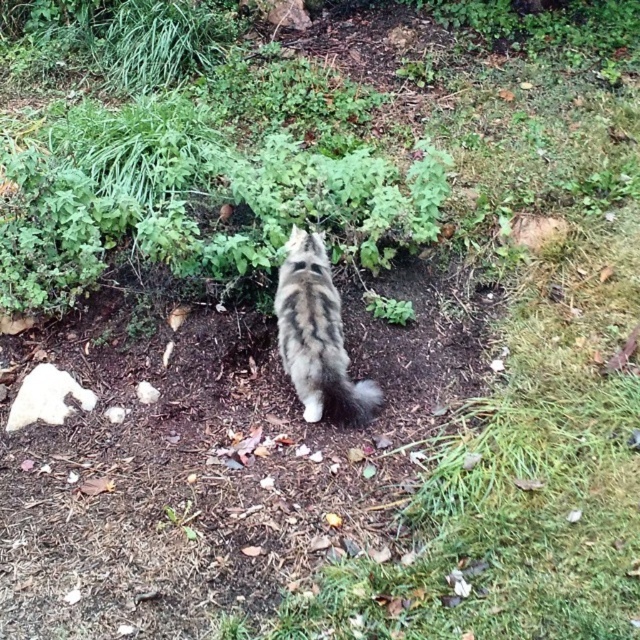
You see a tabby fur cat at center and a fuzzy gray tail at center. Which one is positioned more to the left?

The tabby fur cat at center is positioned more to the left than the fuzzy gray tail at center.

You are a photographer trying to capture the cat in the scene. You notice a point at coordinates (316, 333). What is located at that point?

At point (316, 333) lies the tabby fur cat at center.

You are a photographer trying to capture the tabby fur cat at center and the fuzzy gray tail at center in a single shot. Since the cat is standing on a patch of soil with scattered rocks and leaves, which object should you focus on first to ensure both are in frame?

The tabby fur cat at center is taller than the fuzzy gray tail at center, so you should focus on the tabby fur cat at center first to ensure both are in frame.